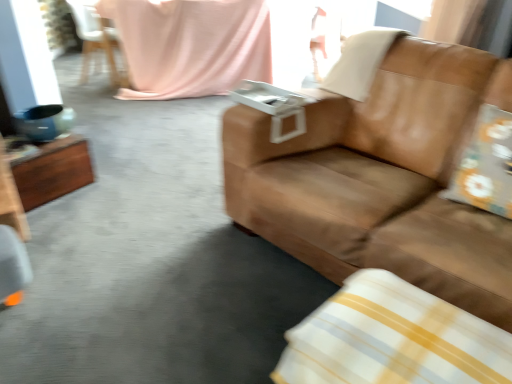
Question: Is white plastic chair at upper left bigger than white/yellow striped pillow at lower right, which is counted as the third pillow, starting from the back?

Choices:
 (A) yes
 (B) no

Answer: (A)

Question: Is white plastic chair at upper left aimed at white/yellow striped pillow at lower right, marked as the 3th pillow in a top-to-bottom arrangement?

Choices:
 (A) yes
 (B) no

Answer: (B)

Question: Is white plastic chair at upper left facing away from white/yellow striped pillow at lower right, which is counted as the third pillow, starting from the back?

Choices:
 (A) yes
 (B) no

Answer: (B)

Question: Considering the relative sizes of white plastic chair at upper left and white/yellow striped pillow at lower right, the 1th pillow positioned from the bottom, in the image provided, is white plastic chair at upper left wider than white/yellow striped pillow at lower right, the 1th pillow positioned from the bottom,?

Choices:
 (A) yes
 (B) no

Answer: (B)

Question: From the image's perspective, is white plastic chair at upper left under white/yellow striped pillow at lower right, marked as the 3th pillow in a top-to-bottom arrangement?

Choices:
 (A) yes
 (B) no

Answer: (B)

Question: Is white/yellow striped pillow at lower right, the first pillow viewed from the front, bigger or smaller than white plastic chair at upper left?

Choices:
 (A) small
 (B) big

Answer: (A)

Question: From the image's perspective, is white/yellow striped pillow at lower right, marked as the 3th pillow in a top-to-bottom arrangement, positioned above or below white plastic chair at upper left?

Choices:
 (A) below
 (B) above

Answer: (A)

Question: Does point (484, 382) appear closer or farther from the camera than point (70, 1)?

Choices:
 (A) farther
 (B) closer

Answer: (B)

Question: Would you say white/yellow striped pillow at lower right, which is counted as the third pillow, starting from the back, is inside or outside white plastic chair at upper left?

Choices:
 (A) inside
 (B) outside

Answer: (B)

Question: Based on their positions, is white/yellow striped pillow at lower right, the first pillow viewed from the front, located to the left or right of floral fabric pillow at right, which appears as the 2th pillow when viewed from the back?

Choices:
 (A) right
 (B) left

Answer: (B)

Question: From the image's perspective, relative to floral fabric pillow at right, which appears as the 2th pillow when viewed from the back, is white/yellow striped pillow at lower right, the first pillow viewed from the front, above or below?

Choices:
 (A) below
 (B) above

Answer: (A)

Question: Considering the positions of white/yellow striped pillow at lower right, the first pillow viewed from the front, and floral fabric pillow at right, which is counted as the second pillow, starting from the top, in the image, is white/yellow striped pillow at lower right, the first pillow viewed from the front, bigger or smaller than floral fabric pillow at right, which is counted as the second pillow, starting from the top,?

Choices:
 (A) big
 (B) small

Answer: (A)

Question: From a real-world perspective, relative to floral fabric pillow at right, which ranks as the second pillow in bottom-to-top order, is white/yellow striped pillow at lower right, marked as the 3th pillow in a top-to-bottom arrangement, vertically above or below?

Choices:
 (A) below
 (B) above

Answer: (A)

Question: Is point (471, 162) positioned closer to the camera than point (400, 296)?

Choices:
 (A) farther
 (B) closer

Answer: (A)

Question: Considering the positions of floral fabric pillow at right, which ranks as the second pillow in bottom-to-top order, and white/yellow striped pillow at lower right, marked as the 3th pillow in a top-to-bottom arrangement, in the image, is floral fabric pillow at right, which ranks as the second pillow in bottom-to-top order, wider or thinner than white/yellow striped pillow at lower right, marked as the 3th pillow in a top-to-bottom arrangement,?

Choices:
 (A) thin
 (B) wide

Answer: (A)